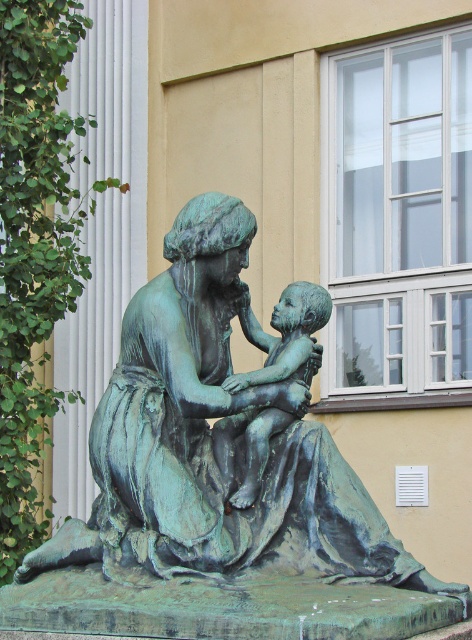
Question: Which of the following is the closest to the observer?

Choices:
 (A) green patina bronze statue at center
 (B) bronze statue of child at center

Answer: (A)

Question: Which object appears closest to the camera in this image?

Choices:
 (A) green patina bronze statue at center
 (B) bronze statue of child at center

Answer: (A)

Question: Does green patina bronze statue at center have a smaller size compared to bronze statue of child at center?

Choices:
 (A) yes
 (B) no

Answer: (B)

Question: Does green patina bronze statue at center appear under bronze statue of child at center?

Choices:
 (A) yes
 (B) no

Answer: (A)

Question: Can you confirm if green patina bronze statue at center is positioned below bronze statue of child at center?

Choices:
 (A) no
 (B) yes

Answer: (B)

Question: Among these objects, which one is farthest from the camera?

Choices:
 (A) bronze statue of child at center
 (B) green patina bronze statue at center

Answer: (A)